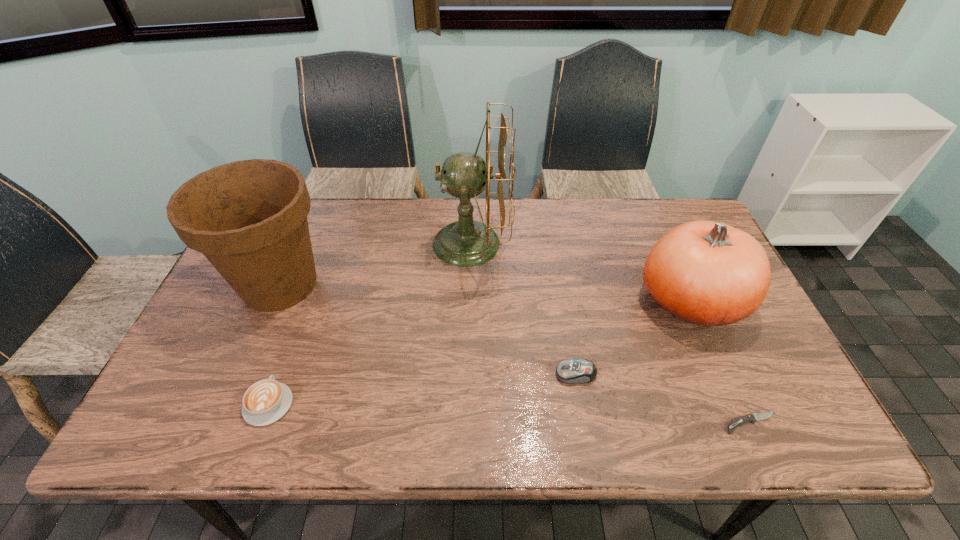
Where is `the fourth object from right to left`? This screenshot has width=960, height=540. the fourth object from right to left is located at coordinates (465, 243).

Identify the location of fan. (465, 243).

Identify the location of flowerpot. (249, 218).

Where is `the third tallest object`? the third tallest object is located at coordinates (706, 273).

I want to click on cappuccino, so click(266, 401).

Locate an element on the screen. The width and height of the screenshot is (960, 540). the third object from right to left is located at coordinates (571, 371).

This screenshot has width=960, height=540. Find the location of `the shortest object`. the shortest object is located at coordinates (754, 417).

Where is `vacant space located 0.300m in front of the third object from left to right, directing air flow`? The width and height of the screenshot is (960, 540). vacant space located 0.300m in front of the third object from left to right, directing air flow is located at coordinates (604, 244).

The image size is (960, 540). Identify the location of vacant space situated on the back of the flowerpot. (314, 206).

Image resolution: width=960 pixels, height=540 pixels. I want to click on vacant space situated on the left of the third tallest object, so click(567, 301).